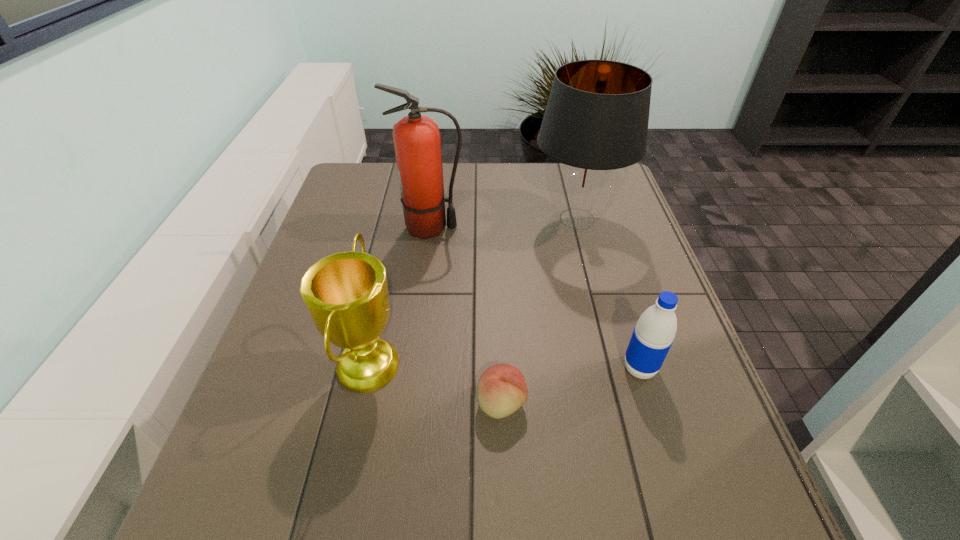
Image resolution: width=960 pixels, height=540 pixels. In order to click on vacant region at the far left corner of the desktop in this screenshot , I will do `click(353, 168)`.

Locate an element on the screen. The height and width of the screenshot is (540, 960). vacant point at the near left corner is located at coordinates (208, 495).

This screenshot has width=960, height=540. I want to click on free space between the lampshade and the fire extinguisher, so click(x=504, y=224).

In order to click on vacant space in between the award and the fire extinguisher in this screenshot , I will do `click(399, 295)`.

In order to click on vacant area between the award and the lampshade in this screenshot , I will do `click(473, 291)`.

Find the location of a particular element. vacant space that is in between the third tallest object and the third object from left to right is located at coordinates (435, 383).

You are a GUI agent. You are given a task and a screenshot of the screen. Output one action in this format:
    pyautogui.click(x=<x>, y=<y>)
    Task: Click on the free space between the lampshade and the peach
    This screenshot has width=960, height=540.
    Given the screenshot: What is the action you would take?
    pyautogui.click(x=540, y=311)

The image size is (960, 540). Identify the location of free space between the peach and the award. (435, 383).

This screenshot has height=540, width=960. In order to click on vacant point located between the fire extinguisher and the fourth tallest object in this screenshot , I will do `click(535, 298)`.

Identify the location of vacant point located between the fire extinguisher and the award. (399, 295).